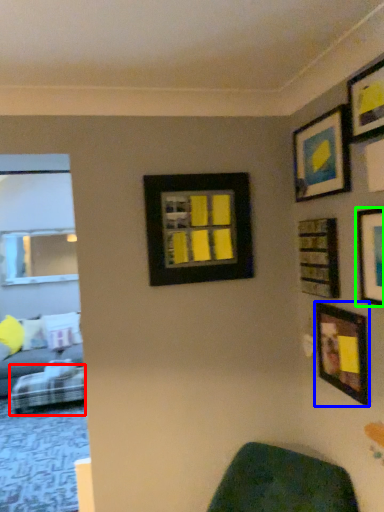
Question: Estimate the real-world distances between objects in this image. Which object is farther from furniture (highlighted by a red box), picture frame (highlighted by a blue box) or picture frame (highlighted by a green box)?

Choices:
 (A) picture frame
 (B) picture frame

Answer: (B)